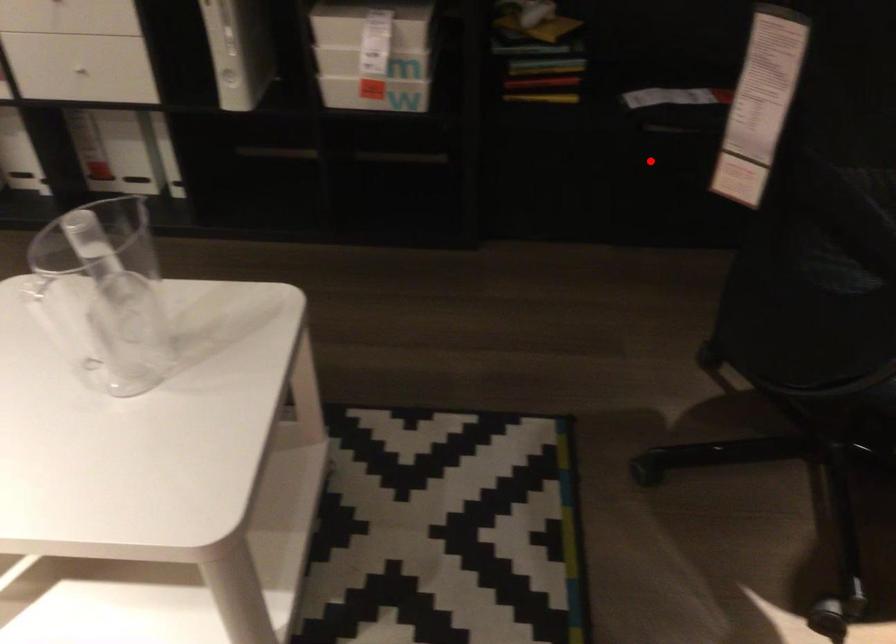
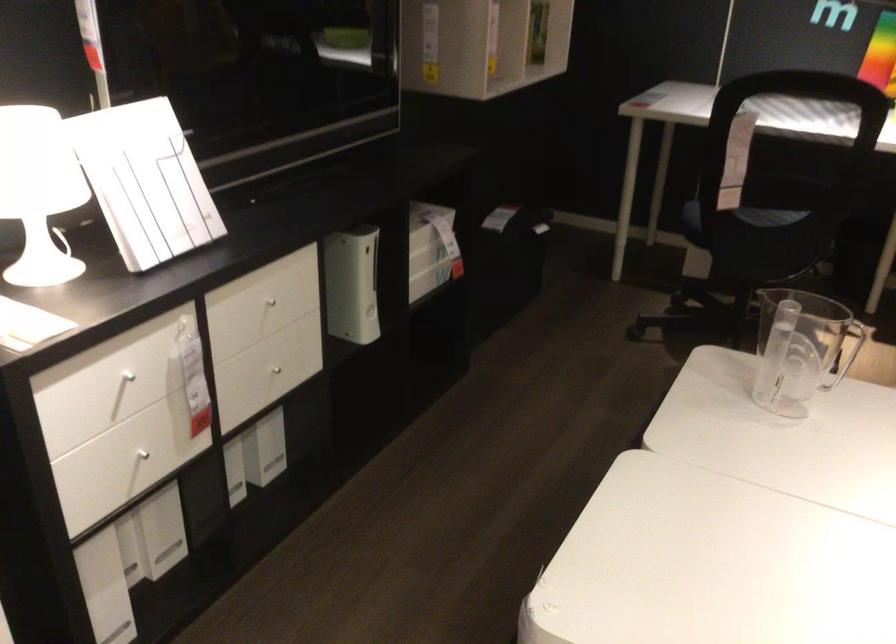
Question: A red point is marked in image1. In image2, is the corresponding 3D point closer to the camera or farther? Reply with the corresponding letter.

Choices:
 (A) The corresponding 3D point is closer.
 (B) The corresponding 3D point is farther.

Answer: (B)